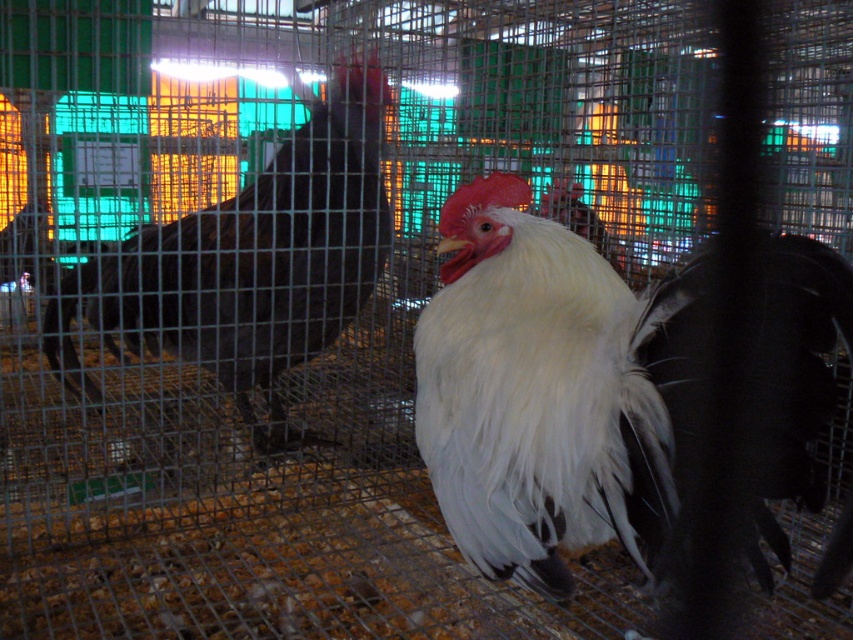
Question: Which point is farther to the camera?

Choices:
 (A) black glossy rooster at center
 (B) white fluffy rooster at center

Answer: (A)

Question: Which point is farther to the camera?

Choices:
 (A) white fluffy rooster at center
 (B) black glossy rooster at center

Answer: (B)

Question: Is white fluffy rooster at center positioned in front of black glossy rooster at center?

Choices:
 (A) yes
 (B) no

Answer: (A)

Question: Which point is closer to the camera taking this photo?

Choices:
 (A) (236, 364)
 (B) (480, 218)

Answer: (B)

Question: Does white fluffy rooster at center have a lesser width compared to black glossy rooster at center?

Choices:
 (A) no
 (B) yes

Answer: (B)

Question: Does white fluffy rooster at center appear over black glossy rooster at center?

Choices:
 (A) yes
 (B) no

Answer: (B)